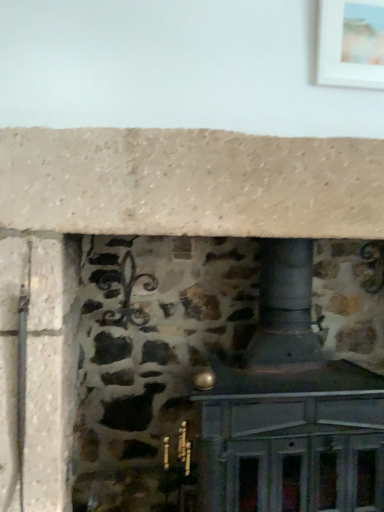
Find the location of a particular element. white matte picture frame at upper right is located at coordinates (351, 42).

What do you see at coordinates (351, 42) in the screenshot?
I see `white matte picture frame at upper right` at bounding box center [351, 42].

The width and height of the screenshot is (384, 512). Find the location of `white matte picture frame at upper right`. white matte picture frame at upper right is located at coordinates (351, 42).